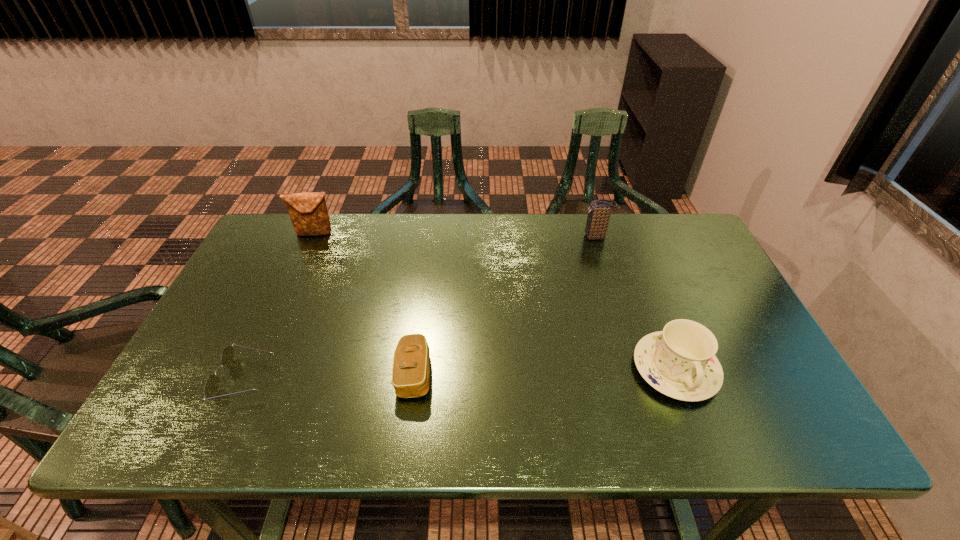
Identify the location of object positioned at the near right corner. (680, 362).

In the image, there is a desktop. Identify the location of vacant space at the far edge. The height and width of the screenshot is (540, 960). point(636,226).

This screenshot has width=960, height=540. Identify the location of free space at the near edge of the desktop. (452, 442).

The height and width of the screenshot is (540, 960). Identify the location of vacant space at the left edge of the desktop. (188, 374).

Identify the location of vacant space at the right edge of the desktop. (699, 319).

You are a GUI agent. You are given a task and a screenshot of the screen. Output one action in this format:
    pyautogui.click(x=<x>, y=<y>)
    Task: Click on the vacant space at the far left corner of the desktop
    This screenshot has width=960, height=540.
    Given the screenshot: What is the action you would take?
    pyautogui.click(x=280, y=242)

In order to click on vacant space at the near left corner in this screenshot , I will do `click(185, 421)`.

Locate an element on the screen. free space at the near right corner of the desktop is located at coordinates (779, 417).

Locate an element on the screen. The image size is (960, 540). vacant point located between the spectacles and the leftmost clutch bag is located at coordinates (280, 306).

Find the location of a particular element. The height and width of the screenshot is (540, 960). free spot between the second clutch bag from right to left and the shortest object is located at coordinates (330, 376).